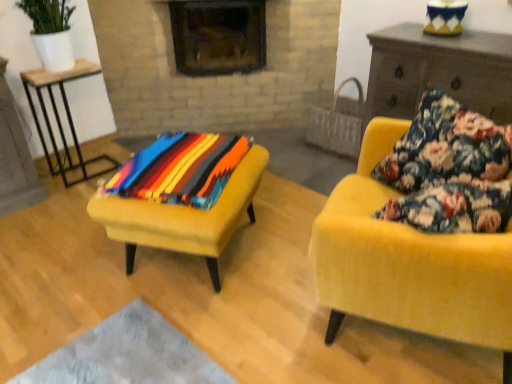
Identify the location of vacant region below wooden table at left (from a real-world perspective). (81, 172).